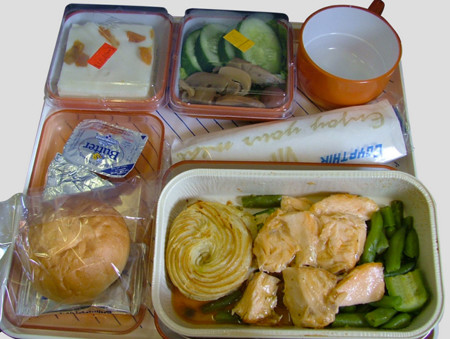
At what (x,y) coordinates should I click in order to perform the action: click on rectangle bowl. Please return your answer as a coordinate pair (x, y). Looking at the image, I should click on (405, 187).